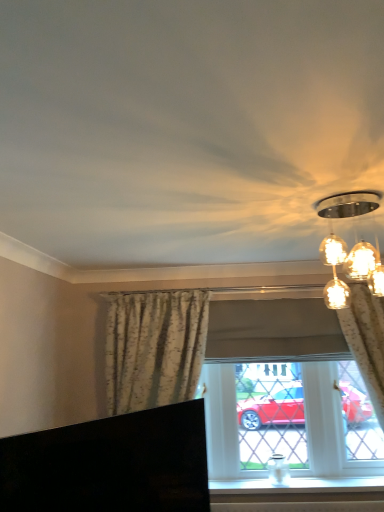
Question: Is floral fabric curtain at center, the 2th curtain in the right-to-left sequence, to the left of matte floral curtains at center from the viewer's perspective?

Choices:
 (A) yes
 (B) no

Answer: (A)

Question: Does floral fabric curtain at center, which ranks as the 1th curtain in left-to-right order, have a greater height compared to matte floral curtains at center?

Choices:
 (A) yes
 (B) no

Answer: (A)

Question: From the image's perspective, is floral fabric curtain at center, which ranks as the 1th curtain in left-to-right order, located above matte floral curtains at center?

Choices:
 (A) no
 (B) yes

Answer: (A)

Question: Considering the relative sizes of floral fabric curtain at center, the 2th curtain in the right-to-left sequence, and matte floral curtains at center in the image provided, is floral fabric curtain at center, the 2th curtain in the right-to-left sequence, wider than matte floral curtains at center?

Choices:
 (A) yes
 (B) no

Answer: (A)

Question: From the image's perspective, does floral fabric curtain at center, which ranks as the 1th curtain in left-to-right order, appear lower than matte floral curtains at center?

Choices:
 (A) yes
 (B) no

Answer: (A)

Question: In the image, is matte glass light fixture at upper right positioned in front of or behind white smooth window sill at lower center?

Choices:
 (A) front
 (B) behind

Answer: (A)

Question: Looking at their shapes, would you say matte glass light fixture at upper right is wider or thinner than white smooth window sill at lower center?

Choices:
 (A) thin
 (B) wide

Answer: (B)

Question: Is matte glass light fixture at upper right taller or shorter than white smooth window sill at lower center?

Choices:
 (A) tall
 (B) short

Answer: (A)

Question: Is matte glass light fixture at upper right to the left or to the right of white smooth window sill at lower center in the image?

Choices:
 (A) left
 (B) right

Answer: (B)

Question: Is matte floral curtains at center to the left or to the right of matte glass light fixture at upper right in the image?

Choices:
 (A) right
 (B) left

Answer: (B)

Question: In terms of width, does matte floral curtains at center look wider or thinner when compared to matte glass light fixture at upper right?

Choices:
 (A) wide
 (B) thin

Answer: (B)

Question: Is matte floral curtains at center inside the boundaries of matte glass light fixture at upper right, or outside?

Choices:
 (A) outside
 (B) inside

Answer: (A)

Question: In terms of height, does matte floral curtains at center look taller or shorter compared to matte glass light fixture at upper right?

Choices:
 (A) tall
 (B) short

Answer: (A)

Question: Is matte floral curtains at center bigger or smaller than white smooth window sill at lower center?

Choices:
 (A) big
 (B) small

Answer: (A)

Question: Considering the positions of point (211, 449) and point (329, 486), is point (211, 449) closer or farther from the camera than point (329, 486)?

Choices:
 (A) farther
 (B) closer

Answer: (A)